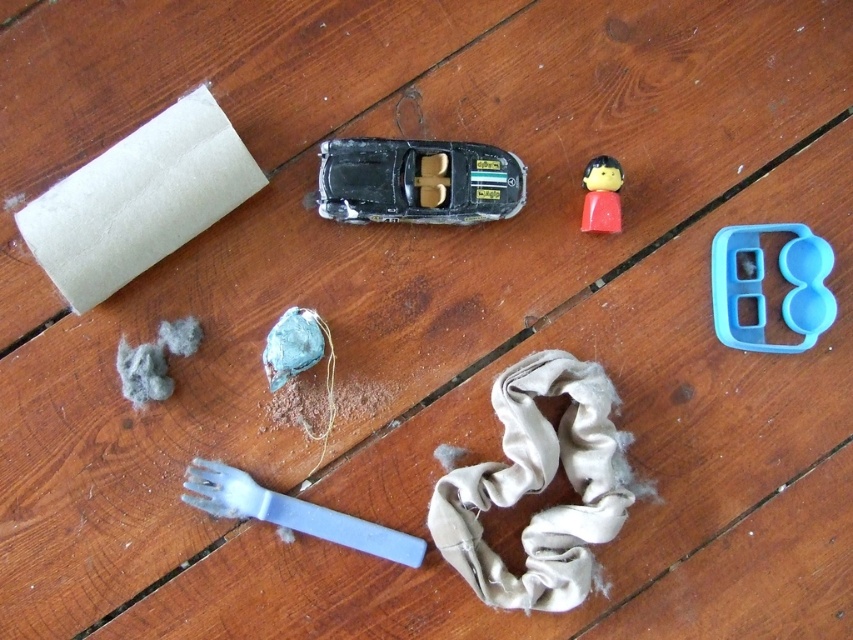
Between blue plastic tray at upper right and smooth plastic figure at upper right, which one has more height?

blue plastic tray at upper right

Is the position of blue plastic tray at upper right more distant than that of smooth plastic figure at upper right?

No, it is not.

Is point (807, 308) farther from camera compared to point (611, 188)?

No.

Identify the location of blue plastic tray at upper right. (761, 285).

Can you confirm if blue plastic fork at lower left is bigger than smooth plastic figure at upper right?

Indeed, blue plastic fork at lower left has a larger size compared to smooth plastic figure at upper right.

Is blue plastic fork at lower left positioned before smooth plastic figure at upper right?

Yes.

Find the location of a particular element. The height and width of the screenshot is (640, 853). blue plastic fork at lower left is located at coordinates (292, 513).

Who is more distant from viewer, (x=450, y=168) or (x=730, y=339)?

The point (x=450, y=168) is behind.

Who is higher up, black plastic toy car at center or blue plastic tray at upper right?

Positioned higher is black plastic toy car at center.

Locate an element on the screen. black plastic toy car at center is located at coordinates (416, 180).